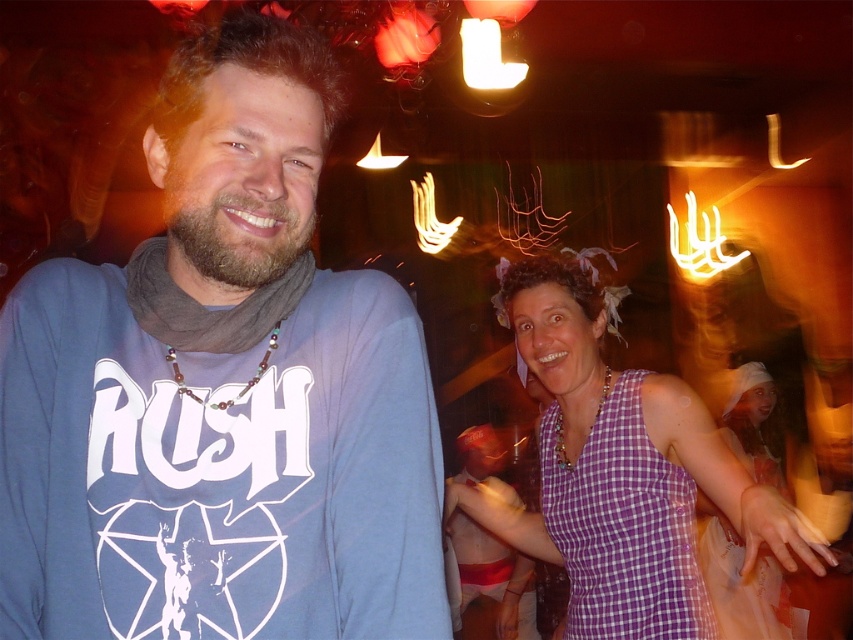
Between blue cotton shirt at left and purple checkered dress at center, which one is positioned higher?

Positioned higher is blue cotton shirt at left.

Does blue cotton shirt at left appear on the right side of purple checkered dress at center?

In fact, blue cotton shirt at left is to the left of purple checkered dress at center.

At what (x,y) coordinates should I click in order to perform the action: click on blue cotton shirt at left. Please return your answer as a coordinate pair (x, y). This screenshot has height=640, width=853. Looking at the image, I should click on (221, 392).